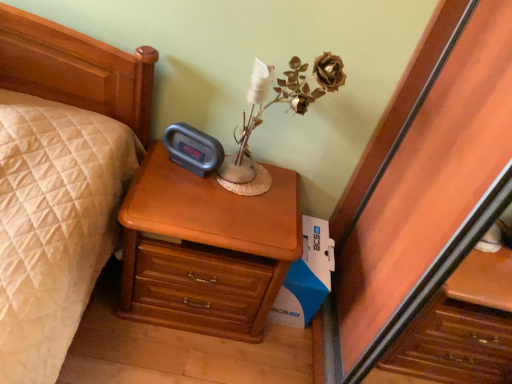
Question: Does brown dried flower at upper right have a lesser height compared to light brown wood nightstand at center?

Choices:
 (A) no
 (B) yes

Answer: (B)

Question: From a real-world perspective, is brown dried flower at upper right on top of light brown wood nightstand at center?

Choices:
 (A) no
 (B) yes

Answer: (B)

Question: Is brown dried flower at upper right wider than light brown wood nightstand at center?

Choices:
 (A) no
 (B) yes

Answer: (A)

Question: Is brown dried flower at upper right located outside light brown wood nightstand at center?

Choices:
 (A) yes
 (B) no

Answer: (A)

Question: Could you tell me if brown dried flower at upper right is facing light brown wood nightstand at center?

Choices:
 (A) yes
 (B) no

Answer: (B)

Question: From the image's perspective, is brown dried flower at upper right below light brown wood nightstand at center?

Choices:
 (A) yes
 (B) no

Answer: (B)

Question: Is light brown wood nightstand at center next to white cardboard box at lower right and touching it?

Choices:
 (A) no
 (B) yes

Answer: (A)

Question: Considering the relative sizes of light brown wood nightstand at center and white cardboard box at lower right in the image provided, is light brown wood nightstand at center taller than white cardboard box at lower right?

Choices:
 (A) no
 (B) yes

Answer: (B)

Question: Is light brown wood nightstand at center positioned beyond the bounds of white cardboard box at lower right?

Choices:
 (A) no
 (B) yes

Answer: (B)

Question: Is the depth of light brown wood nightstand at center less than that of white cardboard box at lower right?

Choices:
 (A) yes
 (B) no

Answer: (A)

Question: Can you confirm if light brown wood nightstand at center is positioned to the left of white cardboard box at lower right?

Choices:
 (A) no
 (B) yes

Answer: (B)

Question: From the image's perspective, would you say light brown wood nightstand at center is shown under white cardboard box at lower right?

Choices:
 (A) no
 (B) yes

Answer: (A)

Question: Is light brown wood nightstand at center at the back of white cardboard box at lower right?

Choices:
 (A) no
 (B) yes

Answer: (A)